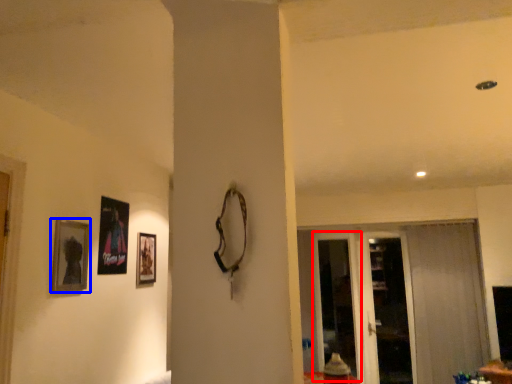
Question: Which object appears farthest to the camera in this image, screen door (highlighted by a red box) or picture frame (highlighted by a blue box)?

Choices:
 (A) screen door
 (B) picture frame

Answer: (A)